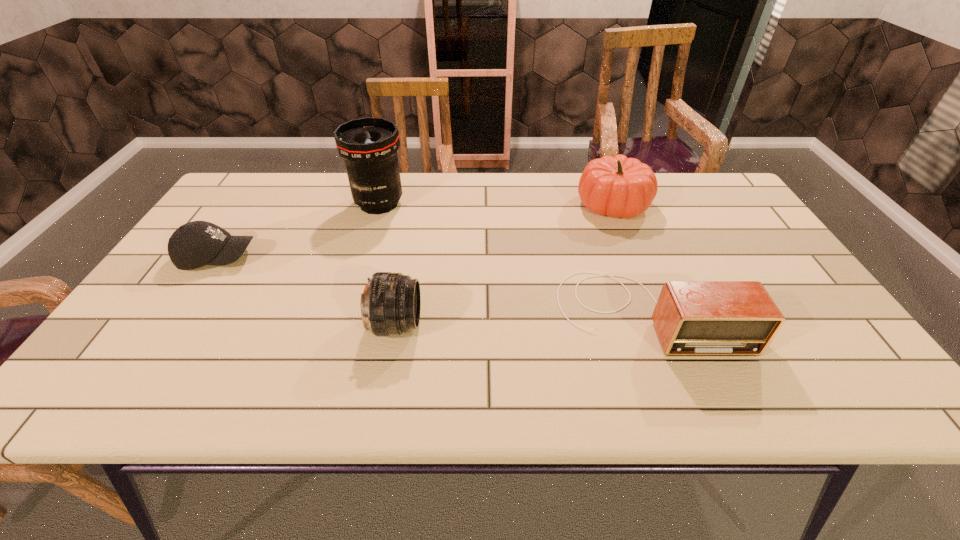
You are a GUI agent. You are given a task and a screenshot of the screen. Output one action in this format:
    pyautogui.click(x=<x>, y=<y>)
    Task: Click on the free region located 0.060m on the front-facing side of the radio receiver
    The image size is (960, 540).
    Given the screenshot: What is the action you would take?
    pyautogui.click(x=674, y=383)

At what (x,y) coordinates should I click in order to perform the action: click on vacant space located on the front-facing side of the shortest object. Please return your answer as a coordinate pair (x, y). The image size is (960, 540). Looking at the image, I should click on (315, 257).

Identify the location of telephoto lens situated at the far edge. (369, 145).

Where is `pumpkin present at the far edge`? pumpkin present at the far edge is located at coordinates (618, 186).

At what (x,y) coordinates should I click in order to perform the action: click on object at the left edge. Please return your answer as a coordinate pair (x, y). Looking at the image, I should click on (195, 244).

Locate an element on the screen. The width and height of the screenshot is (960, 540). free space at the far edge of the desktop is located at coordinates (419, 192).

The height and width of the screenshot is (540, 960). Identify the location of vacant region at the near edge of the desktop. (651, 388).

In the image, there is a desktop. Find the location of `vacant space at the left edge`. vacant space at the left edge is located at coordinates (234, 263).

This screenshot has height=540, width=960. In the image, there is a desktop. In order to click on vacant space at the right edge in this screenshot , I will do `click(726, 249)`.

You are a GUI agent. You are given a task and a screenshot of the screen. Output one action in this format:
    pyautogui.click(x=<x>, y=<y>)
    Task: Click on the vacant area at the far left corner
    This screenshot has height=540, width=960.
    Given the screenshot: What is the action you would take?
    pyautogui.click(x=228, y=191)